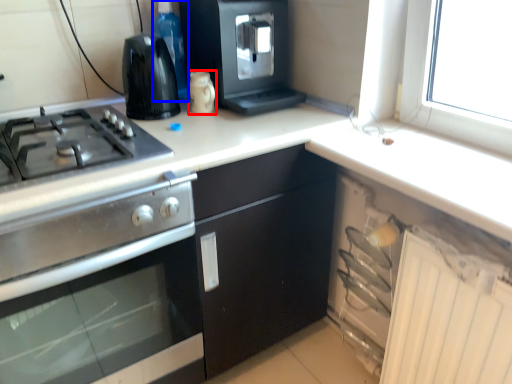
Question: Which point is further to the camera, kitchen appliance (highlighted by a red box) or bottle (highlighted by a blue box)?

Choices:
 (A) kitchen appliance
 (B) bottle

Answer: (B)